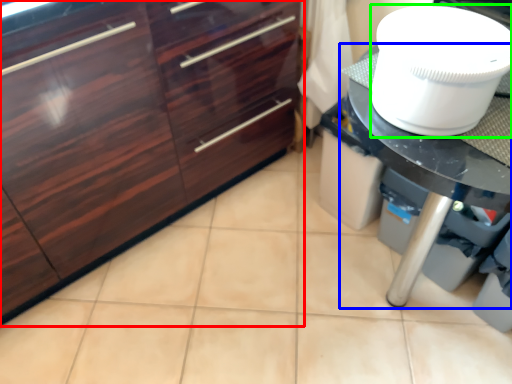
Question: Which object is the farthest from cabinetry (highlighted by a red box)? Choose among these: countertop (highlighted by a blue box) or toilet bowl (highlighted by a green box).

Choices:
 (A) countertop
 (B) toilet bowl

Answer: (A)